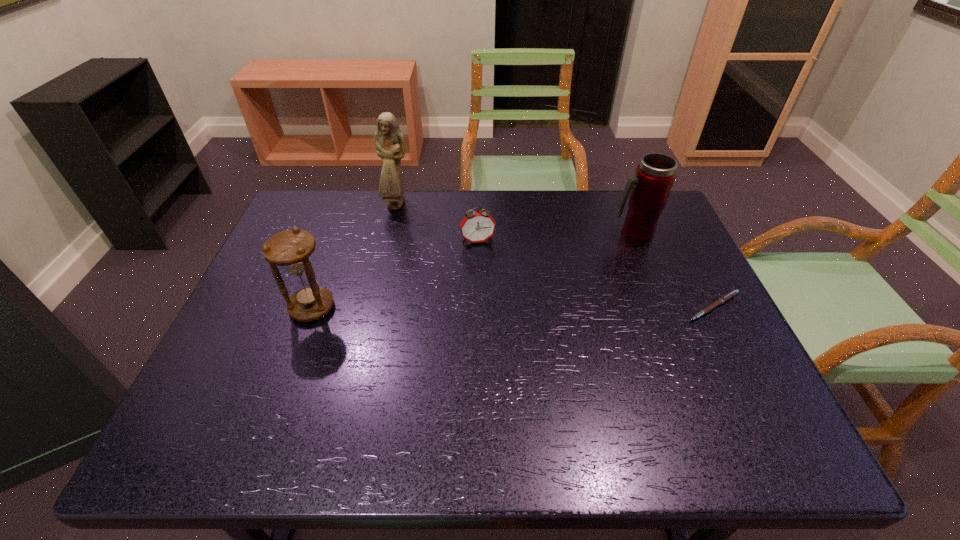
The image size is (960, 540). What are the coordinates of `empty space that is in between the thermos bottle and the figurine` in the screenshot? It's located at (516, 219).

Identify which object is located as the nearest to the thermos bottle. Please provide its 2D coordinates. Your answer should be formatted as a tuple, i.e. [(x, y)], where the tuple contains the x and y coordinates of a point satisfying the conditions above.

[(726, 297)]

The image size is (960, 540). I want to click on object identified as the closest to the fourth tallest object, so click(389, 142).